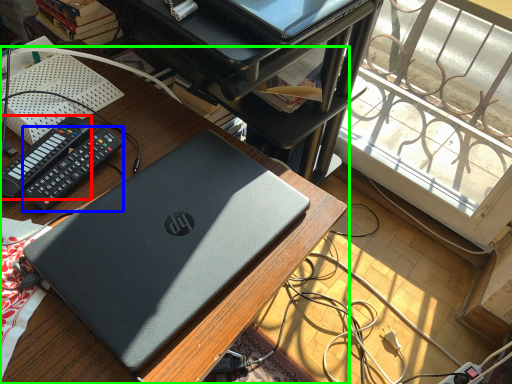
Question: Which is farther away from control (highlighted by a red box)? control (highlighted by a blue box) or desk (highlighted by a green box)?

Choices:
 (A) control
 (B) desk

Answer: (B)